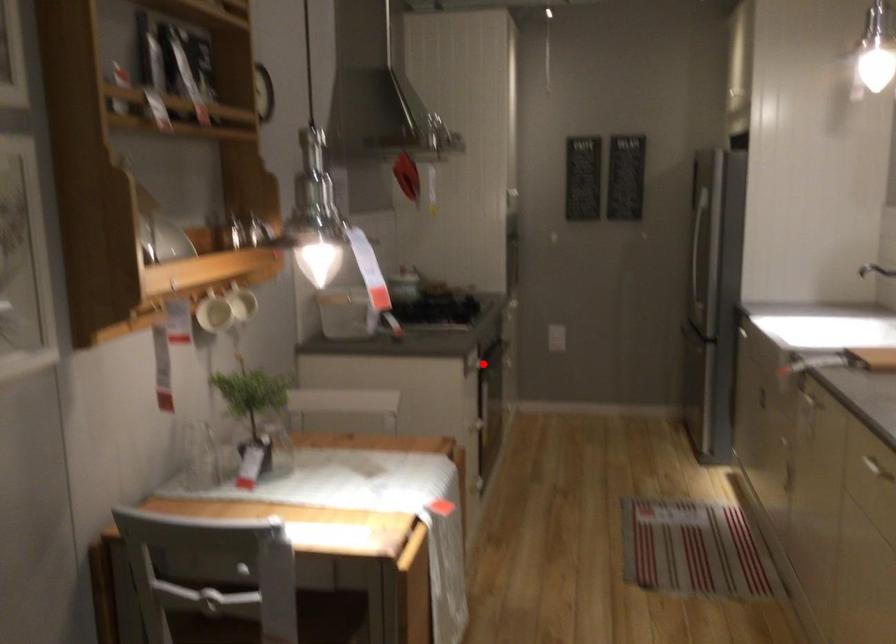
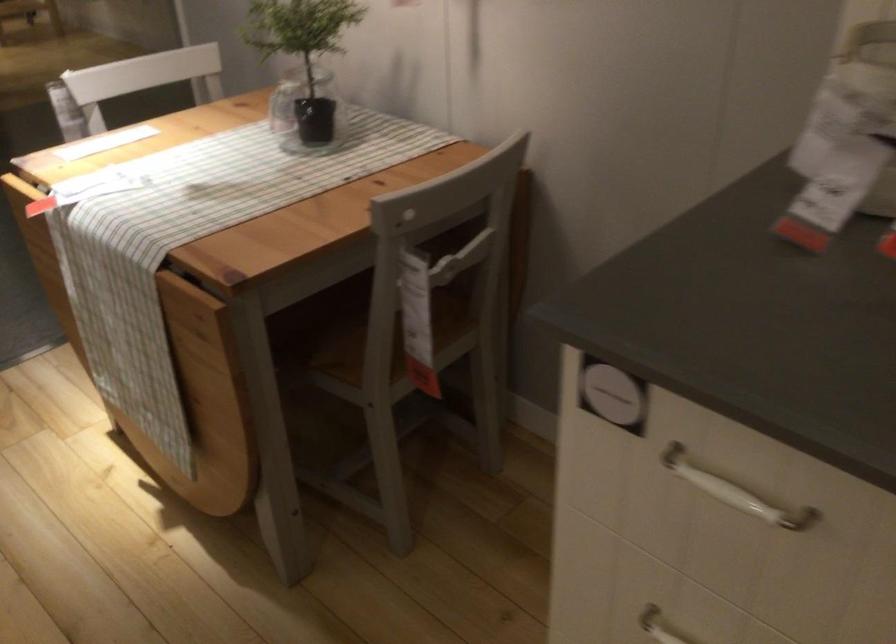
In the second image, find the point that corresponds to the highlighted location in the first image.

(734, 491)